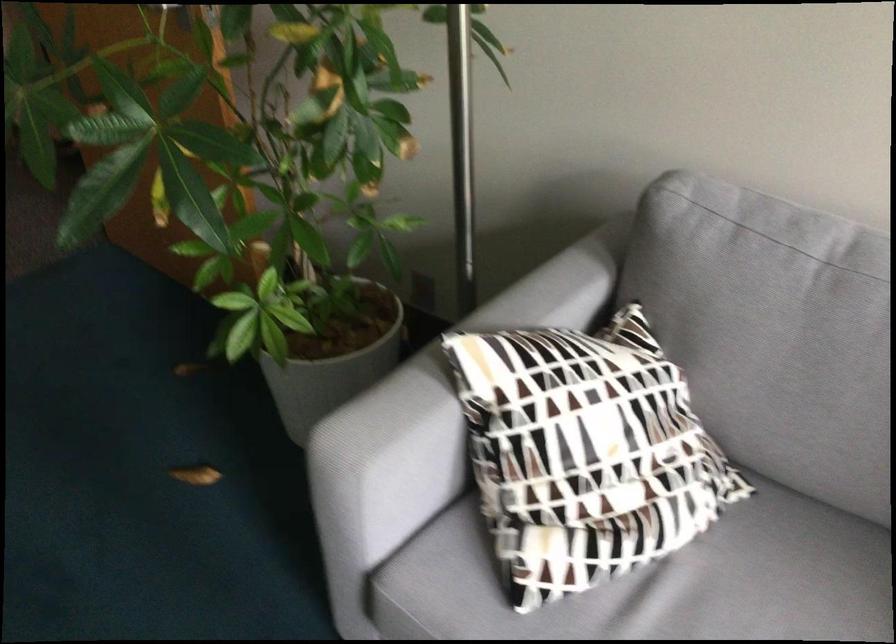
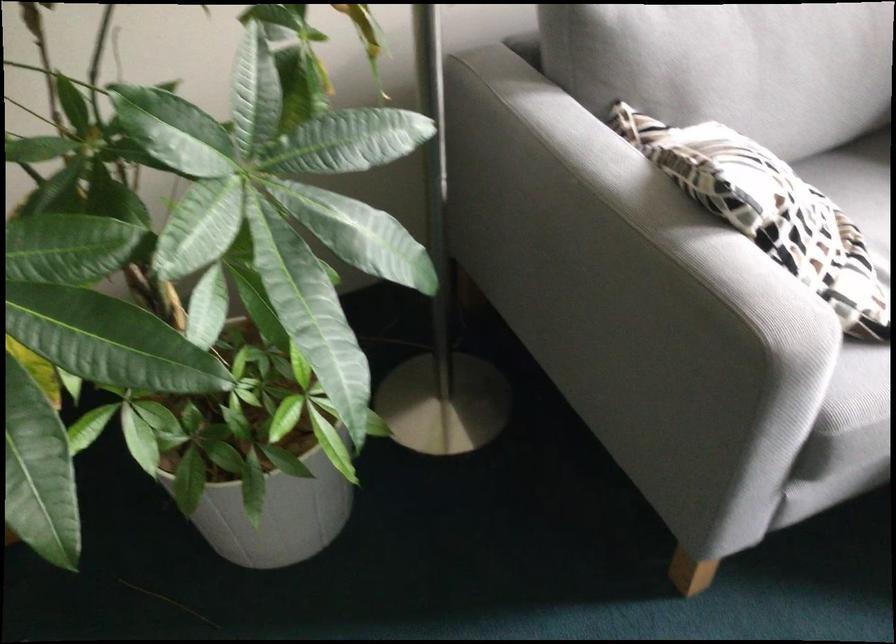
In the second image, find the point that corresponds to point 458,344 in the first image.

(604, 240)